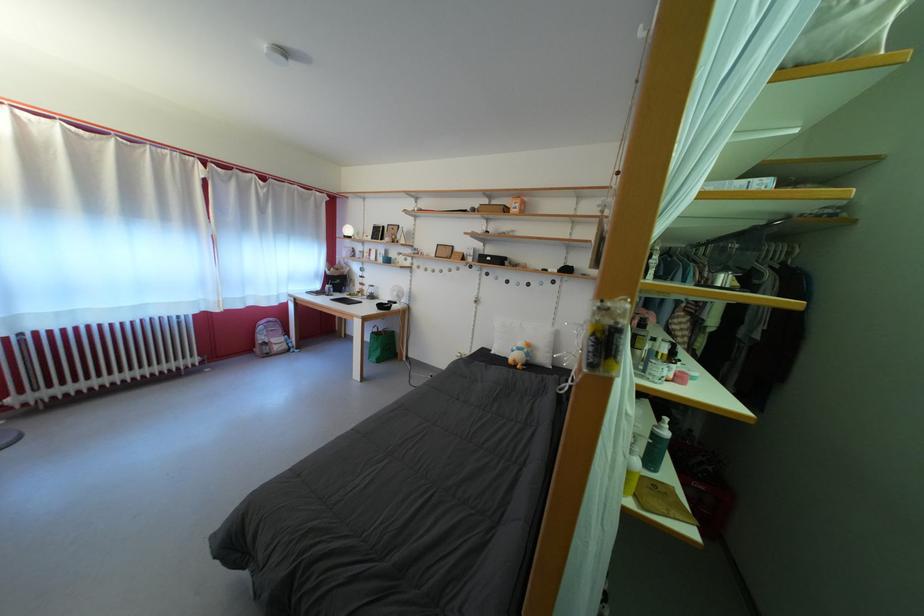
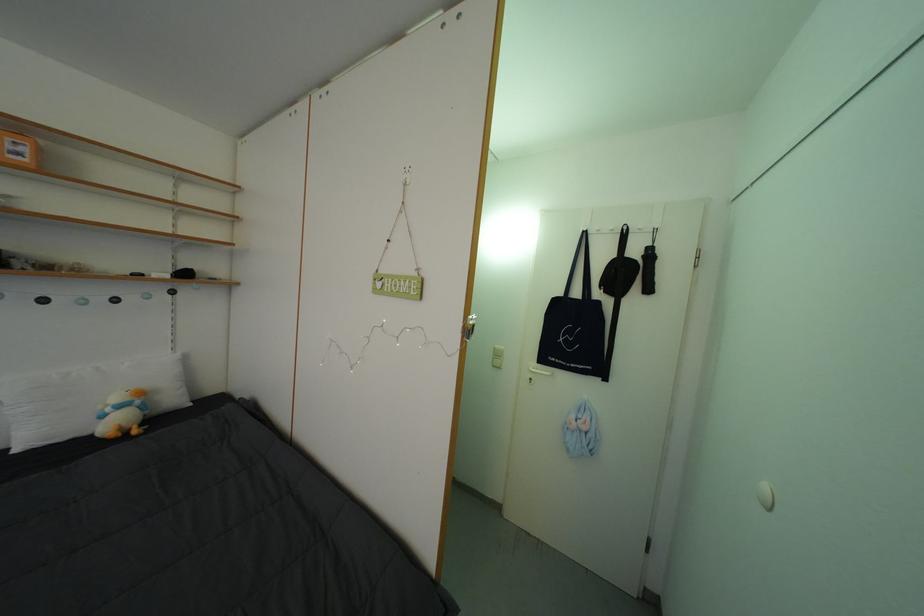
Where in the second image is the point corresponding to [536,361] from the first image?

(152, 413)